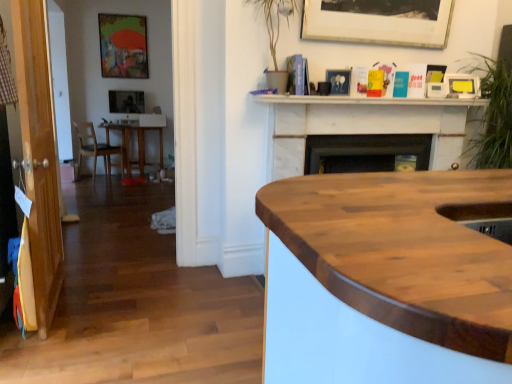
Question: Should I look upward or downward to see white marble fireplace at upper center?

Choices:
 (A) up
 (B) down

Answer: (A)

Question: From the image's perspective, would you say black matte fireplace at center is positioned over transparent wood door at left?

Choices:
 (A) yes
 (B) no

Answer: (A)

Question: Does black matte fireplace at center have a greater height compared to transparent wood door at left?

Choices:
 (A) yes
 (B) no

Answer: (B)

Question: Does black matte fireplace at center turn towards transparent wood door at left?

Choices:
 (A) yes
 (B) no

Answer: (B)

Question: Are black matte fireplace at center and transparent wood door at left located far from each other?

Choices:
 (A) yes
 (B) no

Answer: (A)

Question: Is black matte fireplace at center completely or partially outside of transparent wood door at left?

Choices:
 (A) no
 (B) yes

Answer: (B)

Question: Is the surface of black matte fireplace at center in direct contact with transparent wood door at left?

Choices:
 (A) yes
 (B) no

Answer: (B)

Question: Can we say white marble fireplace at upper center lies outside matte wooden picture frame at upper left, the fourth picture frame ordered from the bottom?

Choices:
 (A) no
 (B) yes

Answer: (B)

Question: Does white marble fireplace at upper center contain matte wooden picture frame at upper left, acting as the first picture frame starting from the left?

Choices:
 (A) no
 (B) yes

Answer: (A)

Question: Does white marble fireplace at upper center have a lesser height compared to matte wooden picture frame at upper left, the 2th picture frame in the back-to-front sequence?

Choices:
 (A) no
 (B) yes

Answer: (B)

Question: From a real-world perspective, is white marble fireplace at upper center located higher than matte wooden picture frame at upper left, positioned as the third picture frame in front-to-back order?

Choices:
 (A) yes
 (B) no

Answer: (B)

Question: From a real-world perspective, is white marble fireplace at upper center positioned under matte wooden picture frame at upper left, acting as the first picture frame starting from the left, based on gravity?

Choices:
 (A) no
 (B) yes

Answer: (B)

Question: Does white marble fireplace at upper center have a greater height compared to matte wooden picture frame at upper left, the 2th picture frame in the back-to-front sequence?

Choices:
 (A) yes
 (B) no

Answer: (B)

Question: Considering the relative sizes of matte wooden picture frame at upper left, positioned as the third picture frame in front-to-back order, and transparent wood door at left in the image provided, is matte wooden picture frame at upper left, positioned as the third picture frame in front-to-back order, smaller than transparent wood door at left?

Choices:
 (A) yes
 (B) no

Answer: (A)